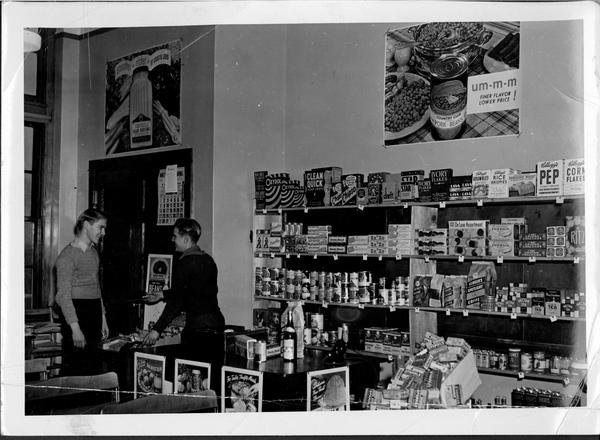
Locate an element on the screen. The image size is (600, 440). posters is located at coordinates (436, 79), (129, 84).